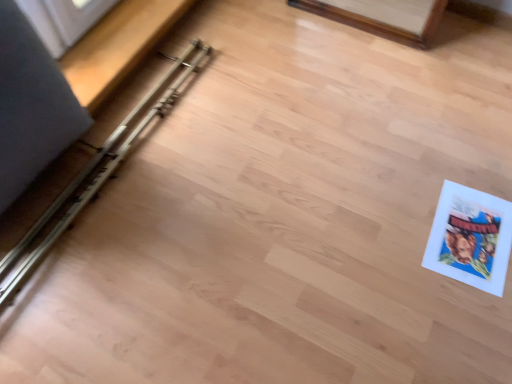
The height and width of the screenshot is (384, 512). I want to click on vacant area that lies between metallic silver rail at left and white paper comic book at lower right, so click(x=257, y=195).